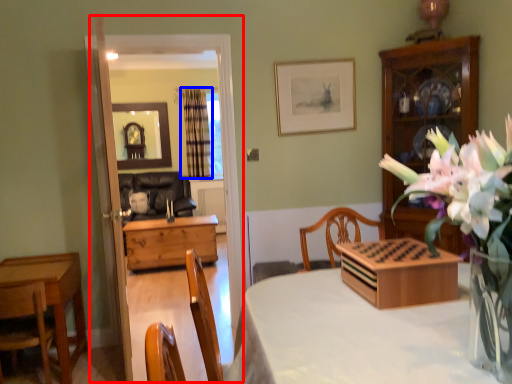
Question: Which object appears closest to the camera in this image, glass door (highlighted by a red box) or curtain (highlighted by a blue box)?

Choices:
 (A) glass door
 (B) curtain

Answer: (A)